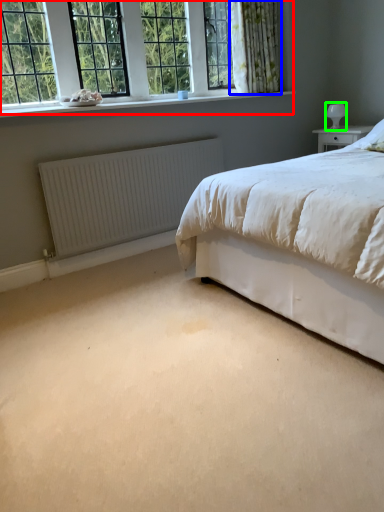
Question: Estimate the real-world distances between objects in this image. Which object is closer to window (highlighted by a red box), curtain (highlighted by a blue box) or table lamp (highlighted by a green box)?

Choices:
 (A) curtain
 (B) table lamp

Answer: (A)